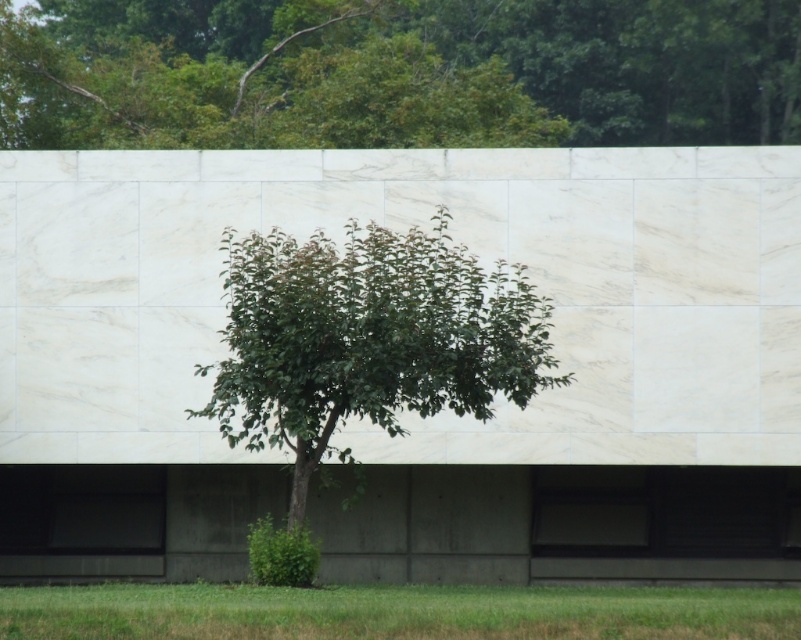
Question: Can you confirm if white marble wall at center is positioned to the right of green leafy tree at center?

Choices:
 (A) yes
 (B) no

Answer: (A)

Question: Does white marble wall at center have a greater width compared to green leafy tree at upper center?

Choices:
 (A) yes
 (B) no

Answer: (B)

Question: Considering the real-world distances, which object is farthest from the green leafy tree at upper center?

Choices:
 (A) white marble wall at center
 (B) green grass at lower center
 (C) green leafy tree at center

Answer: (A)

Question: Which point is farther to the camera?

Choices:
 (A) (215, 100)
 (B) (747, 604)

Answer: (A)

Question: Does green leafy tree at upper center come in front of green leafy tree at center?

Choices:
 (A) yes
 (B) no

Answer: (B)

Question: Among these points, which one is farthest from the camera?

Choices:
 (A) (365, 314)
 (B) (711, 17)
 (C) (103, 193)

Answer: (B)